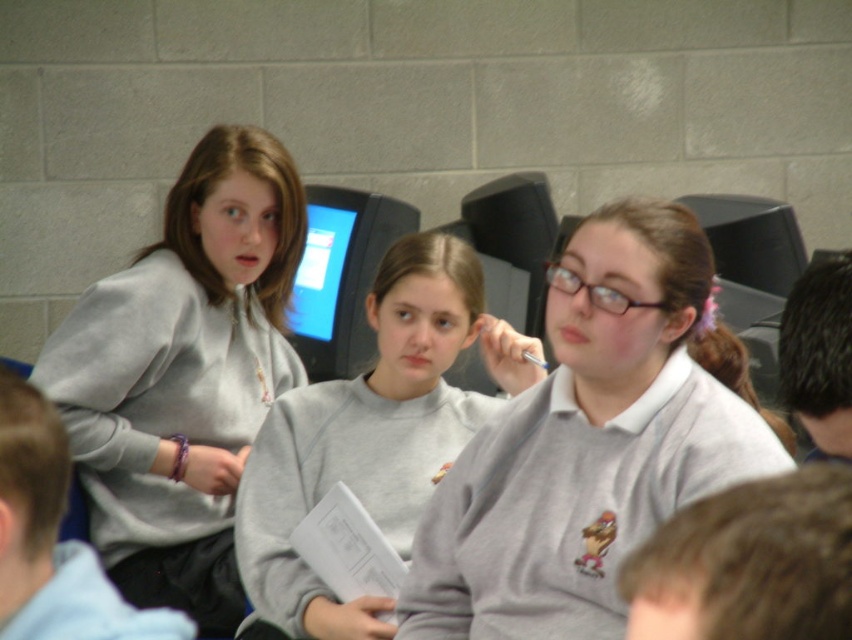
Question: Which object appears closest to the camera in this image?

Choices:
 (A) matte gray sweater at center
 (B) brown hair at lower right

Answer: (B)

Question: Which point is farther to the camera?

Choices:
 (A) (559, 292)
 (B) (285, 305)

Answer: (B)

Question: Is gray sweatshirt at left to the right of brown hair at lower right from the viewer's perspective?

Choices:
 (A) yes
 (B) no

Answer: (B)

Question: Does matte gray sweater at center have a smaller size compared to gray sweatshirt at left?

Choices:
 (A) no
 (B) yes

Answer: (B)

Question: Does matte gray sweater at center have a lesser width compared to gray sweatshirt at left?

Choices:
 (A) no
 (B) yes

Answer: (A)

Question: Which point appears closest to the camera in this image?

Choices:
 (A) (654, 410)
 (B) (296, 609)
 (C) (3, 563)

Answer: (C)